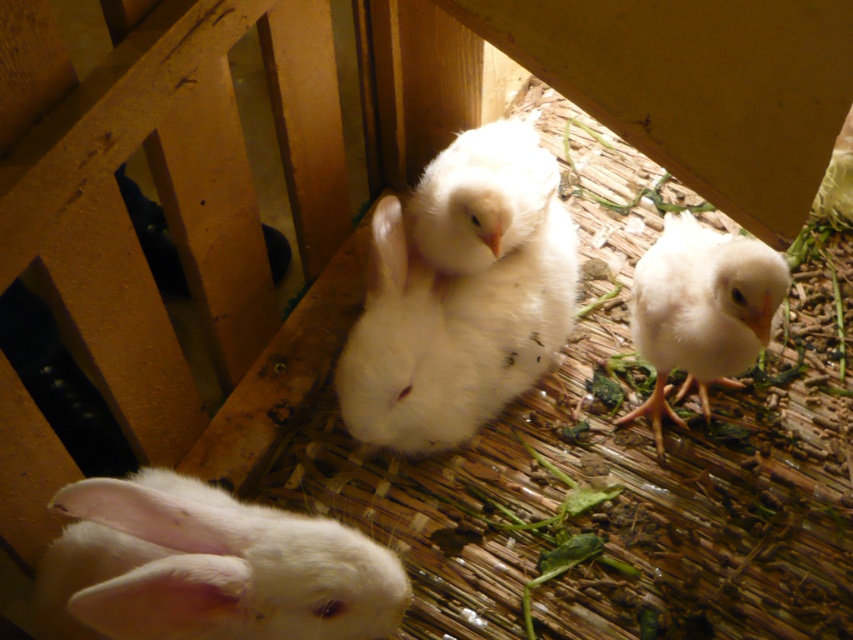
Between white fluffy rabbit at lower left and white fluffy rabbit at lower right, which one appears on the right side from the viewer's perspective?

white fluffy rabbit at lower right

Which is in front, point (268, 612) or point (753, 280)?

Positioned in front is point (268, 612).

Measure the distance between white fluffy rabbit at lower left and camera.

white fluffy rabbit at lower left and camera are 29.42 inches apart from each other.

This screenshot has height=640, width=853. In order to click on white fluffy rabbit at lower left in this screenshot , I will do `click(207, 566)`.

Is white fluffy rabbit at center taller than white fluffy rabbit at lower right?

Yes.

Can you confirm if white fluffy rabbit at center is wider than white fluffy rabbit at lower right?

Correct, the width of white fluffy rabbit at center exceeds that of white fluffy rabbit at lower right.

Which is in front, point (392, 272) or point (724, 323)?

Point (724, 323) is in front.

Identify the location of white fluffy rabbit at center. (460, 292).

Consider the image. Does white fluffy rabbit at center appear on the right side of white fluffy rabbit at lower left?

Indeed, white fluffy rabbit at center is positioned on the right side of white fluffy rabbit at lower left.

Can you confirm if white fluffy rabbit at center is positioned above white fluffy rabbit at lower left?

Indeed, white fluffy rabbit at center is positioned over white fluffy rabbit at lower left.

Where is `white fluffy rabbit at center`? The height and width of the screenshot is (640, 853). white fluffy rabbit at center is located at coordinates (460, 292).